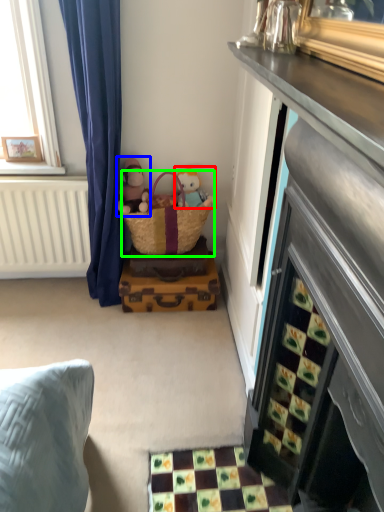
Question: Considering the real-world distances, which object is farthest from toy (highlighted by a red box)? doll (highlighted by a blue box) or picnic basket (highlighted by a green box)?

Choices:
 (A) doll
 (B) picnic basket

Answer: (A)